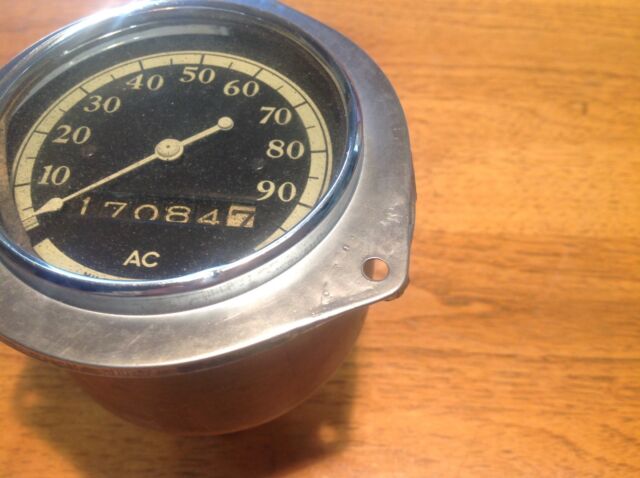
This screenshot has height=478, width=640. In order to click on wooden table in this screenshot , I will do [x=465, y=294].